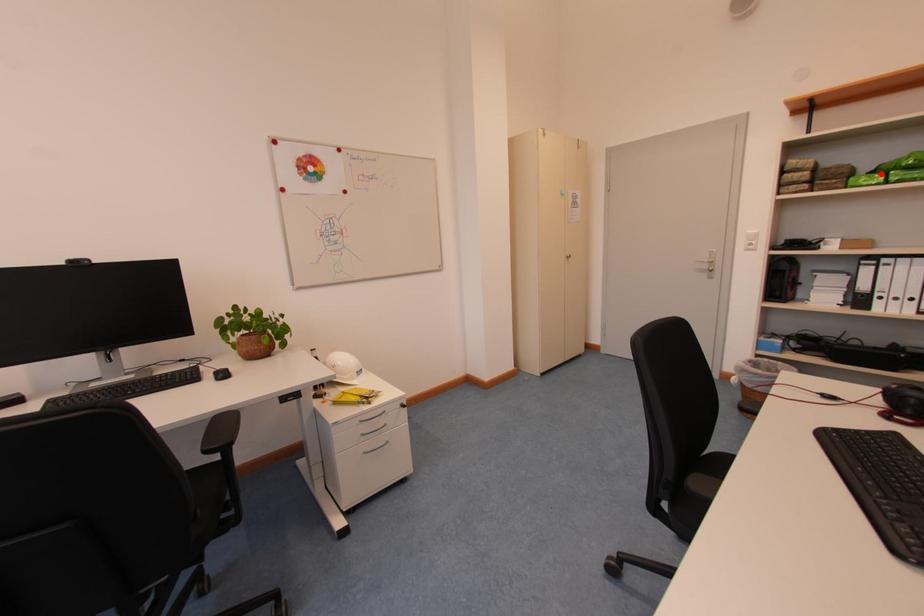
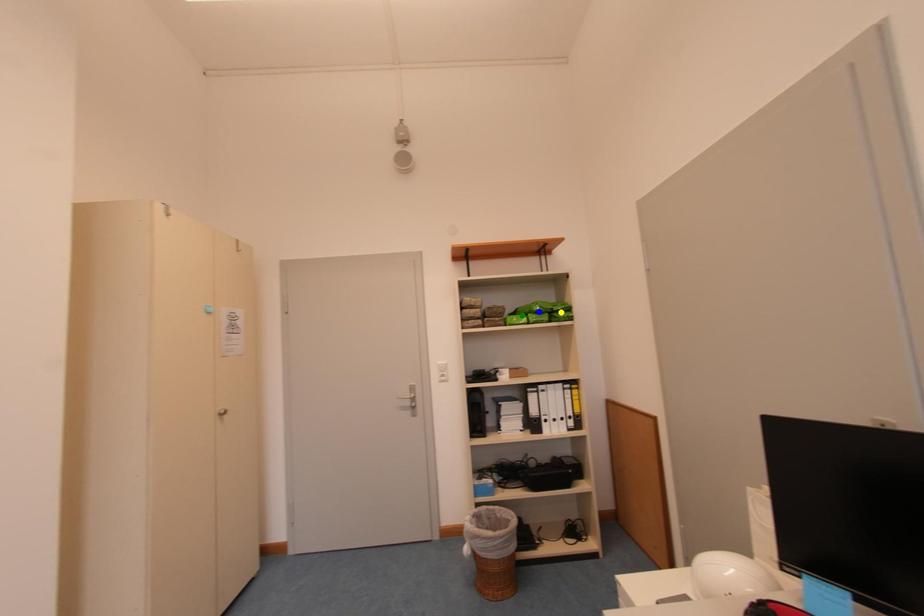
Question: I am providing you with two images of the same scene from different viewpoints. A red point is marked on the first image. You are given multiple points on the second image. Which spot in image 2 lines up with the point in image 1?

Choices:
 (A) green point
 (B) blue point
 (C) yellow point

Answer: (A)